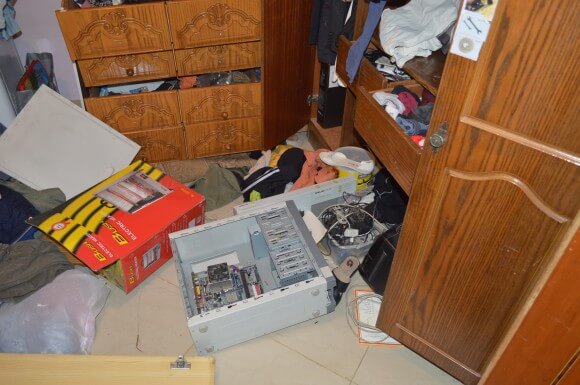
You are a GUI agent. You are given a task and a screenshot of the screen. Output one action in this format:
    pyautogui.click(x=<x>, y=<y>)
    Task: Click on the light brown hardwood table
    The image size is (580, 385).
    Given the screenshot: What is the action you would take?
    pyautogui.click(x=90, y=368)